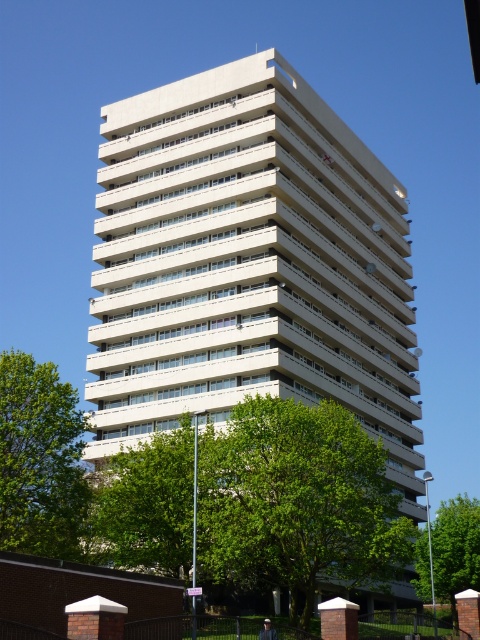
You are standing at the origin point of the coordinate system. The white smooth building at center is located at point 0.412, 0.519. If you want to walk directly towards the building, which direction should you head?

Since the white smooth building at center is located at coordinates (249,262) relative to your position at the origin, you should head in the positive x and y directions to reach it.

You are standing in front of the residential building and want to place a new bench between the green leafy tree at lower center and the green leafy tree at lower left. Which tree has a wider spread, and where should you position the bench to ensure it doesn not block the path between them?

The green leafy tree at lower center has a wider spread than the green leafy tree at lower left. To ensure the bench doesn not block the path between them, place it closer to the narrower tree, which is the green leafy tree at lower left.

You are standing in front of the residential building and want to plant a new tree that will eventually grow taller than the green leafy tree at lower left but not taller than the green leafy tree at center. Which existing tree should you use as a height reference to ensure your new tree meets this requirement?

The green leafy tree at center is taller than the green leafy tree at lower left. To meet the requirement, use the green leafy tree at center as the upper height limit and the green leafy tree at lower left as the minimum height reference.